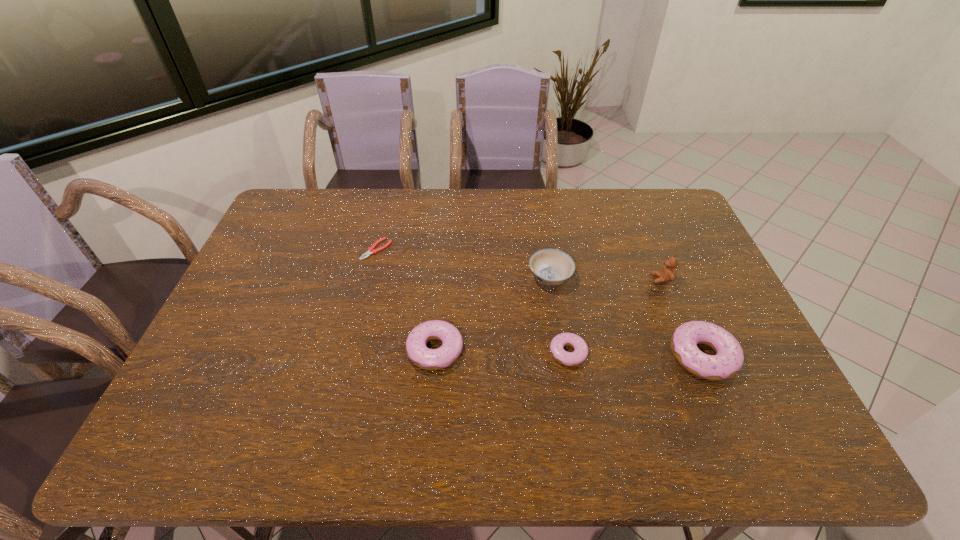
Identify the location of vacant space that satisfies the following two spatial constraints: 1. on the front side of the bowl; 2. on the right side of the shortest object. (370, 277).

Image resolution: width=960 pixels, height=540 pixels. What are the coordinates of `vacant space that satisfies the following two spatial constraints: 1. on the back side of the rightmost doughnut; 2. on the face of the tallest object` in the screenshot? It's located at (670, 279).

At what (x,y) coordinates should I click in order to perform the action: click on vacant space that satisfies the following two spatial constraints: 1. on the face of the tallest object; 2. on the front side of the second object from left to right. Please return your answer as a coordinate pair (x, y). Looking at the image, I should click on (690, 349).